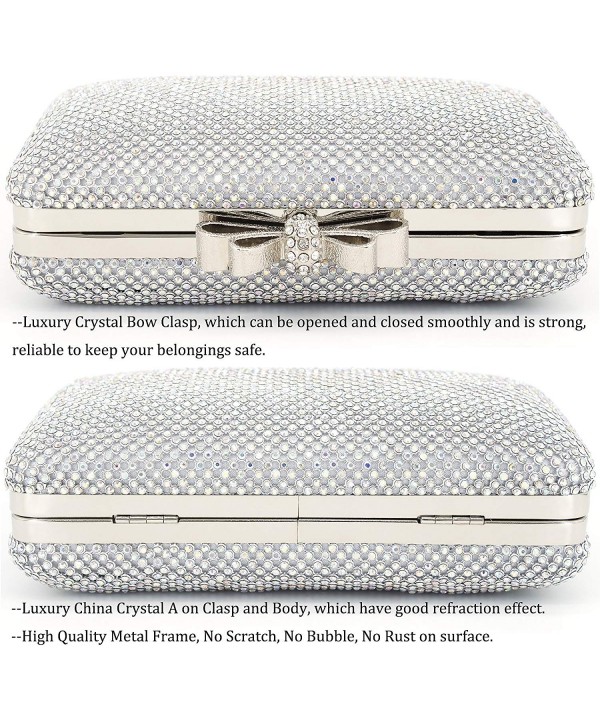
Find the location of a particular element. The image size is (600, 720). left hinge is located at coordinates (160, 516).